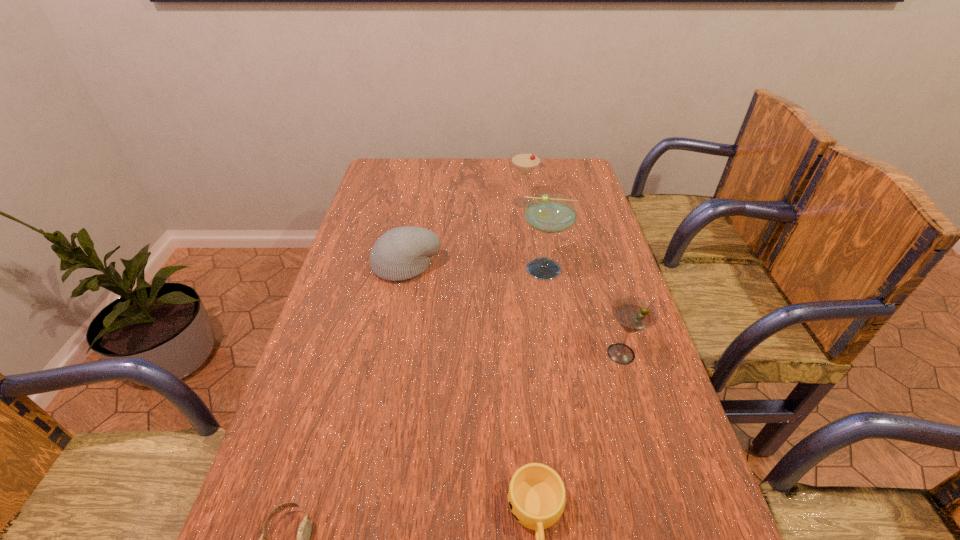
Where is `the tallest object`? the tallest object is located at coordinates (547, 213).

Identify the location of the second farthest martini. The height and width of the screenshot is (540, 960). (547, 213).

Find the location of a particular element. The image size is (960, 540). the farthest martini is located at coordinates (525, 162).

The width and height of the screenshot is (960, 540). What are the coordinates of `the rightmost object` in the screenshot? It's located at (634, 314).

Locate an element on the screen. the rightmost martini is located at coordinates (634, 314).

Image resolution: width=960 pixels, height=540 pixels. Identify the location of the third shortest object. (401, 253).

I want to click on free spot located 0.190m on the front of the tallest martini, so click(559, 338).

The width and height of the screenshot is (960, 540). In order to click on free region located on the back of the farthest object in this screenshot , I will do [x=519, y=178].

Where is `free space located on the back of the fourth farthest object`? The image size is (960, 540). free space located on the back of the fourth farthest object is located at coordinates (597, 274).

The width and height of the screenshot is (960, 540). What are the coordinates of `free spot located on the right of the beanie` in the screenshot? It's located at (516, 266).